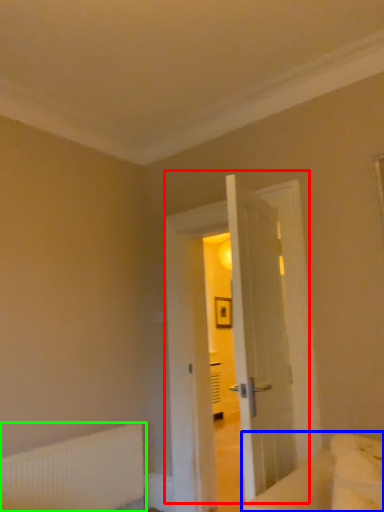
Question: Which is farther away from door (highlighted by a red box)? bed (highlighted by a blue box) or radiator (highlighted by a green box)?

Choices:
 (A) bed
 (B) radiator

Answer: (A)